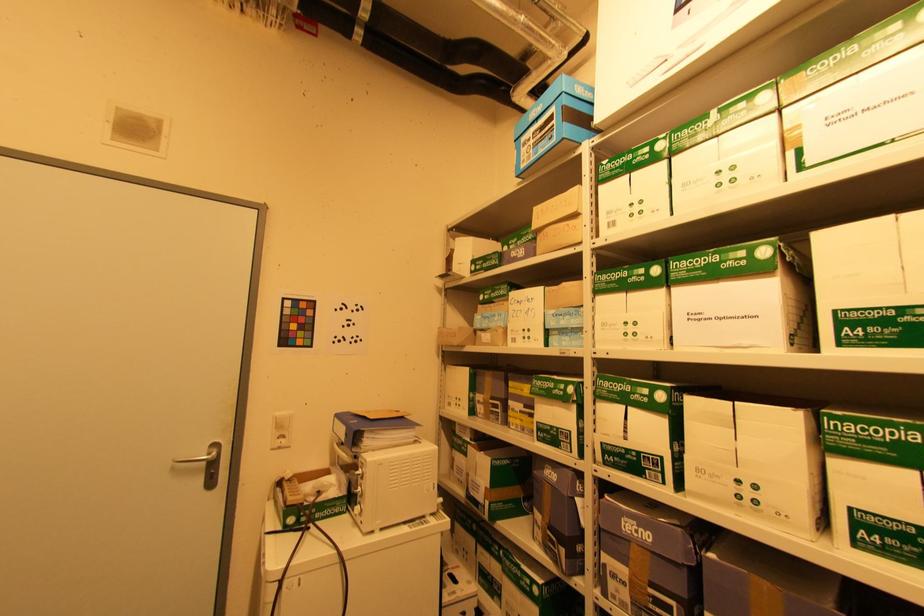
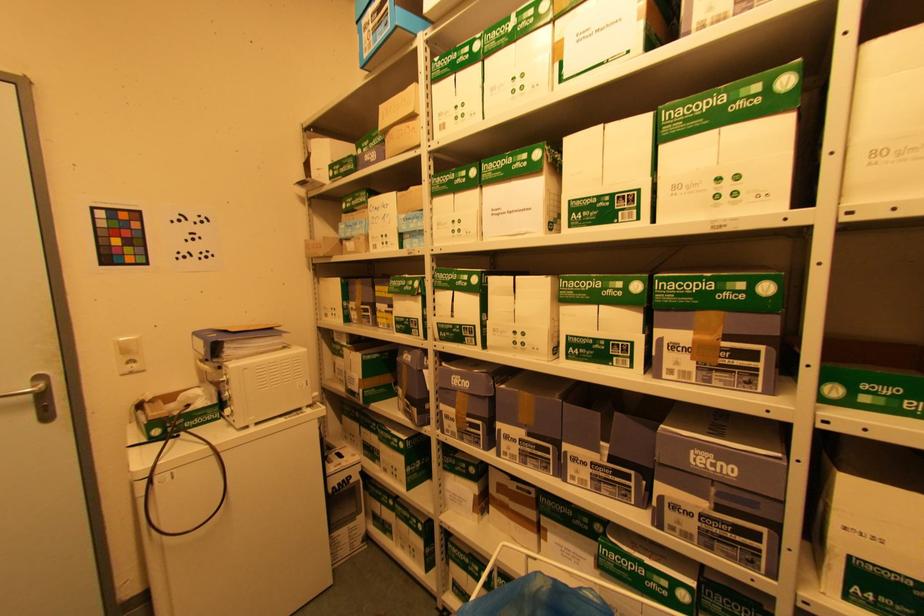
The images are taken continuously from a first-person perspective. In which direction are you moving?

The cameraman moved toward right, backward.